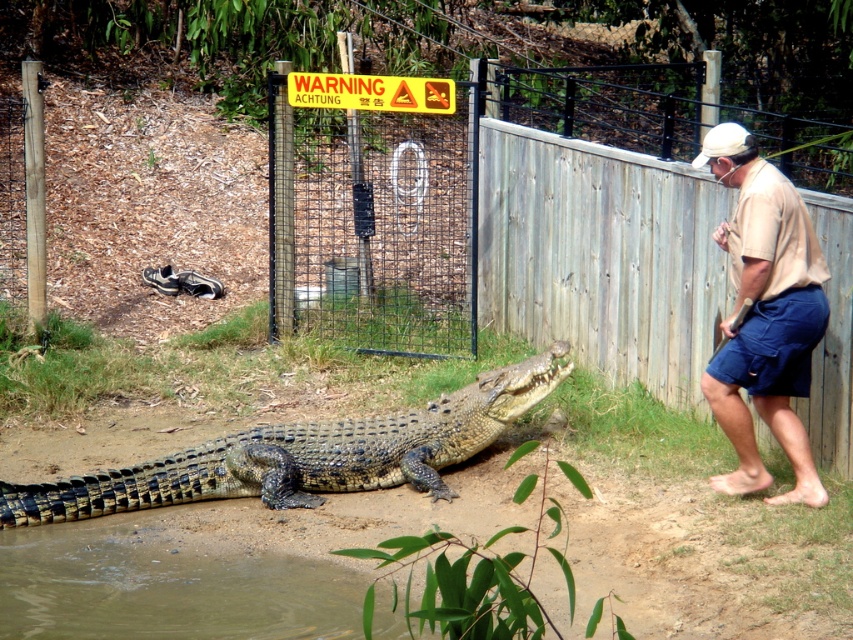
You are a visitor at the wildlife park and notice both the shiny dark green scales at center and the blue cotton shorts at right. Which object is wider?

The shiny dark green scales at center are wider than the blue cotton shorts at right.

You are standing at the point with coordinates [372,227]. You want to move towards the large crocodile resting on the dirt path near the water. Is the yellow plastic sign at center in your path?

The yellow plastic sign at center is located at the point with coordinates [372,227], so yes, it is in your path towards the large crocodile resting on the dirt path near the water.

You are a visitor at the wildlife park and notice the brown murky water at lower left and the blue cotton shorts at right. Which object is positioned lower in the image?

The brown murky water at lower left is positioned lower than the blue cotton shorts at right.